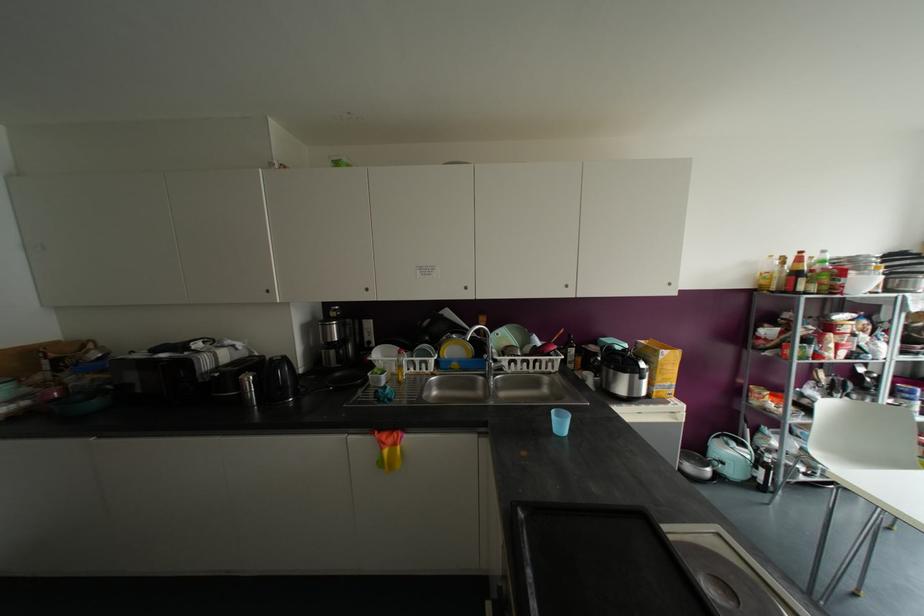
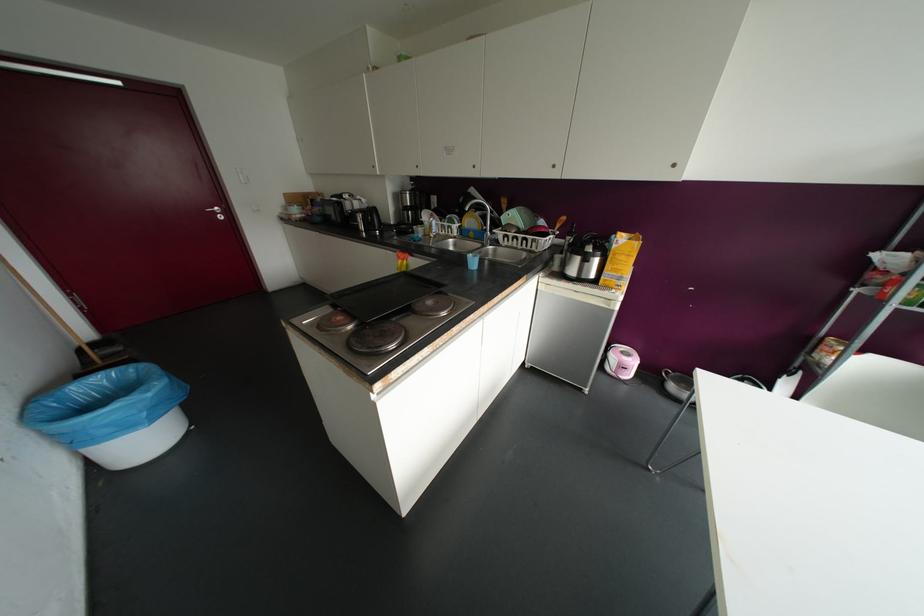
Where in the second image is the point corresponding to the point at 454,349 from the first image?

(469, 221)